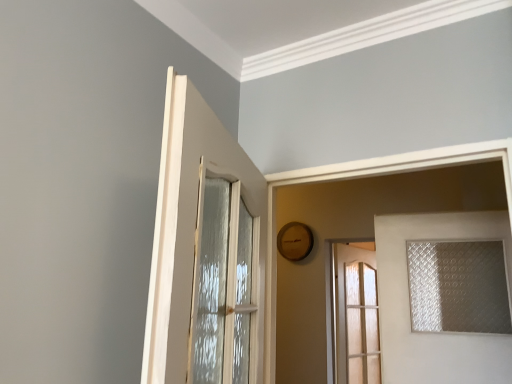
Question: Is translucent glass door at center, which appears as the second door when viewed from the left, smaller than clear glass door at right, the 1th door from the right?

Choices:
 (A) no
 (B) yes

Answer: (A)

Question: Considering the relative sizes of translucent glass door at center, which is counted as the first door, starting from the back, and clear glass door at right, the third door in the left-to-right sequence, in the image provided, is translucent glass door at center, which is counted as the first door, starting from the back, shorter than clear glass door at right, the third door in the left-to-right sequence,?

Choices:
 (A) yes
 (B) no

Answer: (B)

Question: Is translucent glass door at center, acting as the second door starting from the right, positioned far away from clear glass door at right, the 2th door in the front-to-back sequence?

Choices:
 (A) no
 (B) yes

Answer: (B)

Question: From the image's perspective, is translucent glass door at center, which appears as the second door when viewed from the left, on top of clear glass door at right, the 2th door in the front-to-back sequence?

Choices:
 (A) yes
 (B) no

Answer: (B)

Question: Are translucent glass door at center, which appears as the second door when viewed from the left, and clear glass door at right, the 2th door in the front-to-back sequence, beside each other?

Choices:
 (A) no
 (B) yes

Answer: (A)

Question: Would you say clear glass door at right, the third door in the left-to-right sequence, is part of translucent glass door at center, which is counted as the first door, starting from the back,'s contents?

Choices:
 (A) no
 (B) yes

Answer: (A)

Question: From a real-world perspective, does translucent frosted glass window at right stand above translucent glass door at center, acting as the second door starting from the right?

Choices:
 (A) no
 (B) yes

Answer: (B)

Question: Is translucent frosted glass window at right aimed at translucent glass door at center, the third door when ordered from front to back?

Choices:
 (A) yes
 (B) no

Answer: (B)

Question: Does translucent frosted glass window at right have a lesser width compared to translucent glass door at center, the third door when ordered from front to back?

Choices:
 (A) no
 (B) yes

Answer: (A)

Question: Is translucent glass door at center, which is counted as the first door, starting from the back, located within translucent frosted glass window at right?

Choices:
 (A) no
 (B) yes

Answer: (A)

Question: Is translucent frosted glass window at right to the left of translucent glass door at center, which is counted as the first door, starting from the back, from the viewer's perspective?

Choices:
 (A) no
 (B) yes

Answer: (A)

Question: Is translucent frosted glass window at right touching translucent glass door at center, which is counted as the first door, starting from the back?

Choices:
 (A) yes
 (B) no

Answer: (B)

Question: Is clear glass door at right, the second door viewed from the back, positioned behind white glossy door at upper left, which is the 3th door from right to left?

Choices:
 (A) yes
 (B) no

Answer: (A)